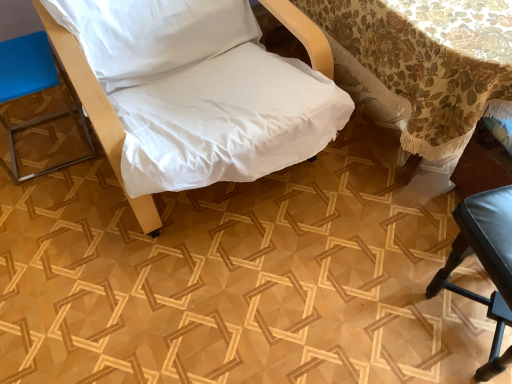
This screenshot has width=512, height=384. What are the coordinates of `free space in front of blue leather stool at left, the 1th furniture when ordered from left to right` in the screenshot? It's located at (50, 200).